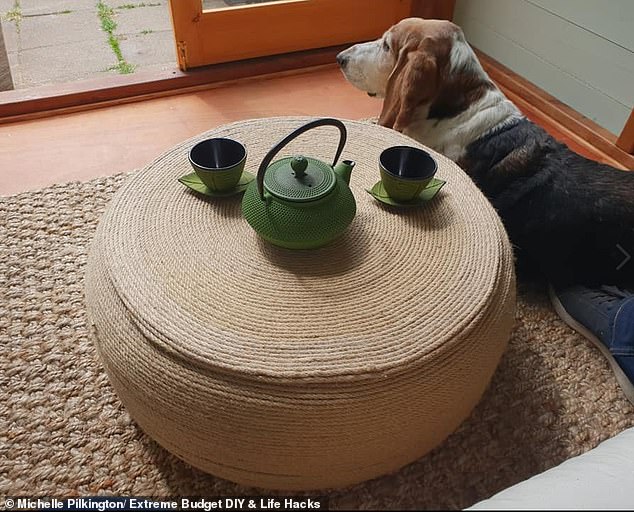
The width and height of the screenshot is (634, 512). In order to click on rug in this screenshot , I will do `click(56, 323)`.